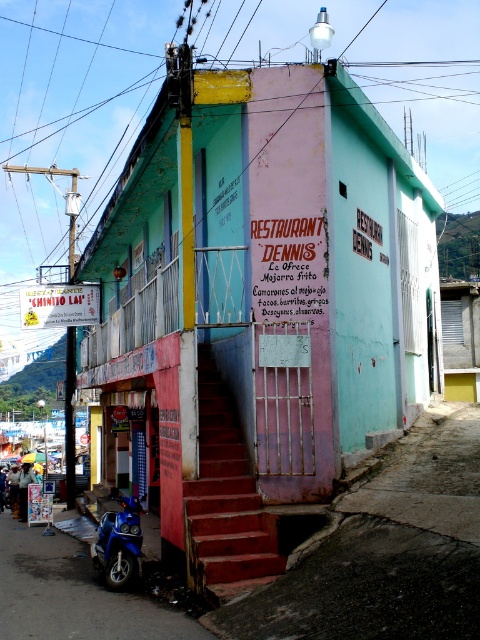
You are a delivery person who needs to park your motorcycle. You see two motorcycles at the lower left corner of the image, a blue metallic motorcycle at lower left and a blue glossy motorcycle at lower left. Which motorcycle is positioned lower between them?

The blue metallic motorcycle at lower left is positioned lower because it is below the blue glossy motorcycle at lower left.

You are standing at the entrance of Dennis restaurant and want to take a photo of the staircase. Where should you position yourself to capture the red painted stairs at center in the frame?

To capture the red painted stairs at center in your photo, position yourself at the entrance facing towards the center of the scene, as the stairs are located at the central area marked by their 2D coordinates at point (225,499).

You are a delivery person who needs to park your motorcycle near the entrance of the restaurant Dennis. The entrance is located at point 0.5, 0.5. Can you determine if the blue metallic motorcycle at lower left is parked close enough to the entrance?

The blue metallic motorcycle at lower left is located at point (72,595). The entrance is at (240,320). The distance between them is sqrt